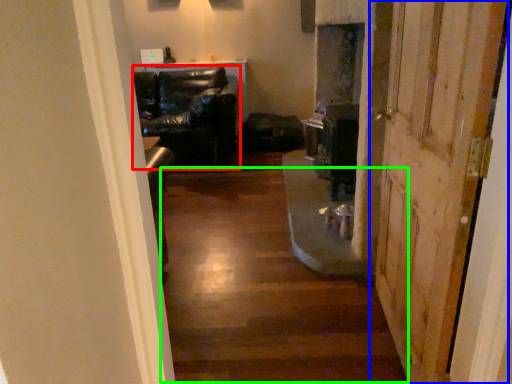
Question: Which object is positioned closest to chair (highlighted by a red box)? Select from door (highlighted by a blue box) and stairwell (highlighted by a green box).

Choices:
 (A) door
 (B) stairwell

Answer: (B)